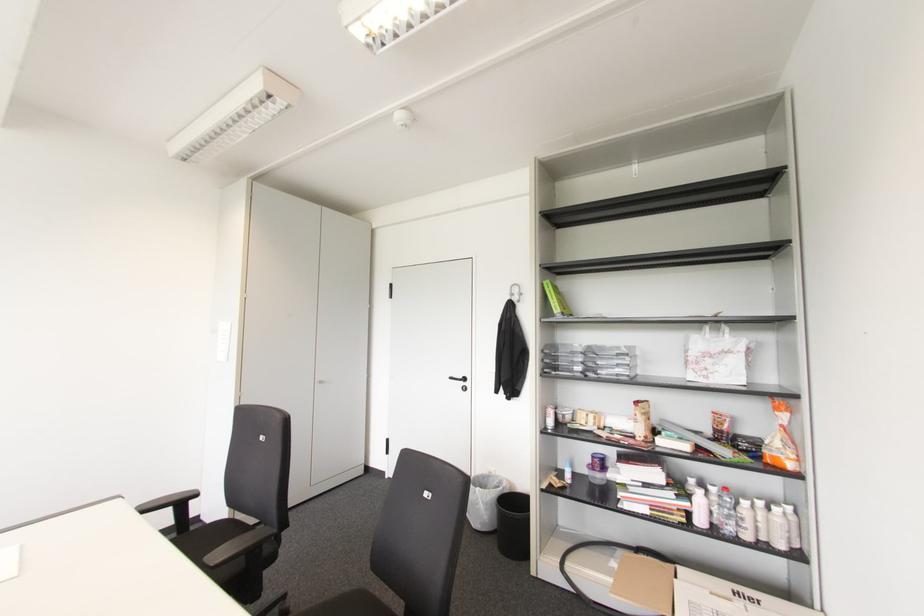
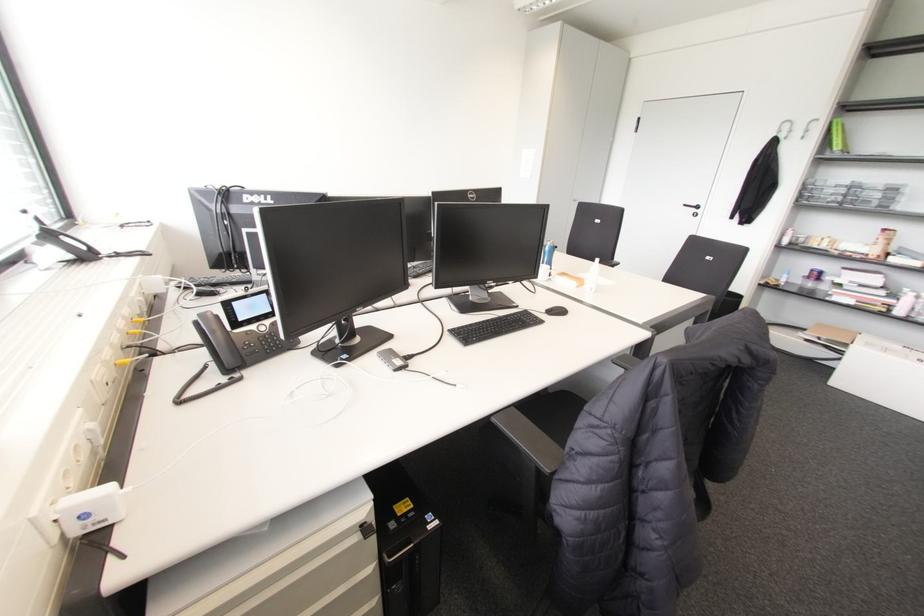
Question: I am providing you with two images of the same scene from different viewpoints. After the viewpoint changes to image2, which objects are now occluded?

Choices:
 (A) black chair armrest
 (B) black telephone handset
 (C) small orange fruit
 (D) white spray bottle

Answer: (A)